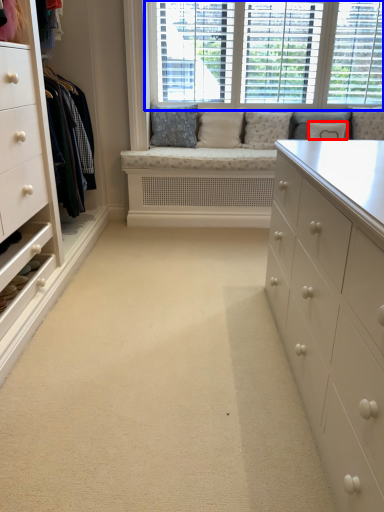
Question: Which object appears farthest to the camera in this image, pillow (highlighted by a red box) or window (highlighted by a blue box)?

Choices:
 (A) pillow
 (B) window

Answer: (A)